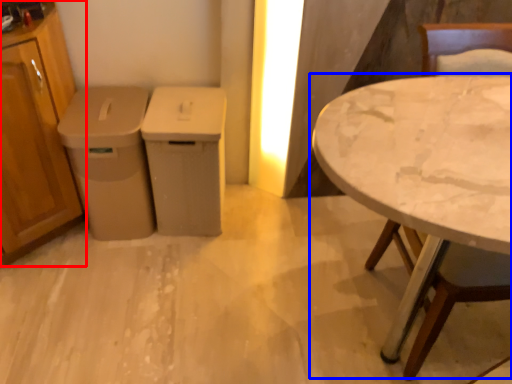
Question: Which object appears farthest to the camera in this image, cabinetry (highlighted by a red box) or table (highlighted by a blue box)?

Choices:
 (A) cabinetry
 (B) table

Answer: (A)